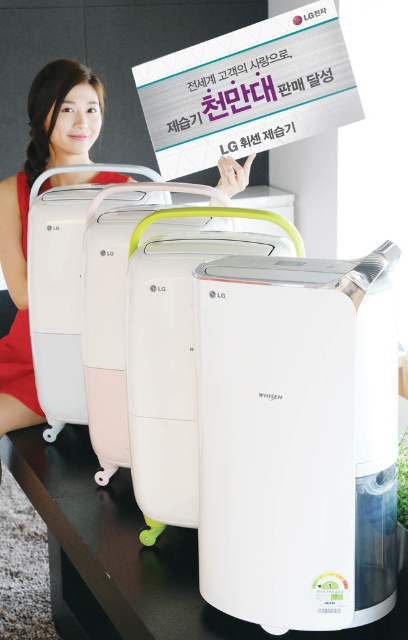
Question: Is black glossy table at center positioned behind matte pink dress at left?

Choices:
 (A) no
 (B) yes

Answer: (A)

Question: Which object is positioned farthest from the black glossy table at center?

Choices:
 (A) matte pink dress at upper left
 (B) white paper at upper center

Answer: (B)

Question: Which object is farther from the camera taking this photo?

Choices:
 (A) black glossy table at center
 (B) white paper at upper center
 (C) matte pink dress at upper left
 (D) matte pink dress at left

Answer: (D)

Question: Among these objects, which one is nearest to the camera?

Choices:
 (A) matte pink dress at left
 (B) matte pink dress at upper left

Answer: (B)

Question: Is white paper at upper center positioned at the back of matte pink dress at upper left?

Choices:
 (A) no
 (B) yes

Answer: (A)

Question: From the image, what is the correct spatial relationship of white paper at upper center in relation to matte pink dress at left?

Choices:
 (A) below
 (B) above

Answer: (B)